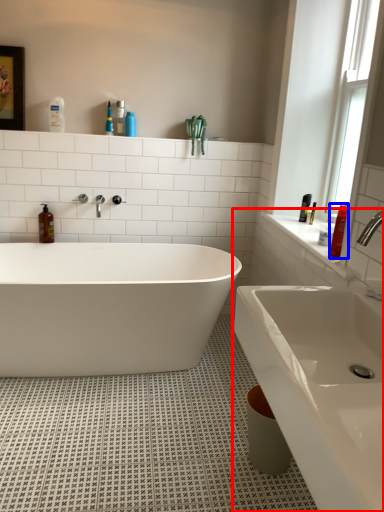
Question: Among these objects, which one is nearest to the camera, sink (highlighted by a red box) or toiletry (highlighted by a blue box)?

Choices:
 (A) sink
 (B) toiletry

Answer: (A)